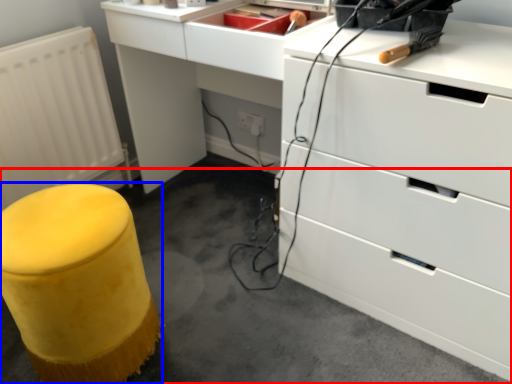
Question: Which object appears farthest to the camera in this image, concrete (highlighted by a red box) or furniture (highlighted by a blue box)?

Choices:
 (A) concrete
 (B) furniture

Answer: (B)